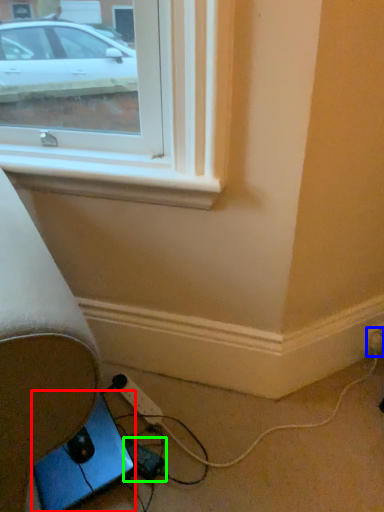
Question: Based on their relative distances, which object is nearer to gadget (highlighted by a red box)? Choose from electric outlet (highlighted by a blue box) and extension cord (highlighted by a green box).

Choices:
 (A) electric outlet
 (B) extension cord

Answer: (B)